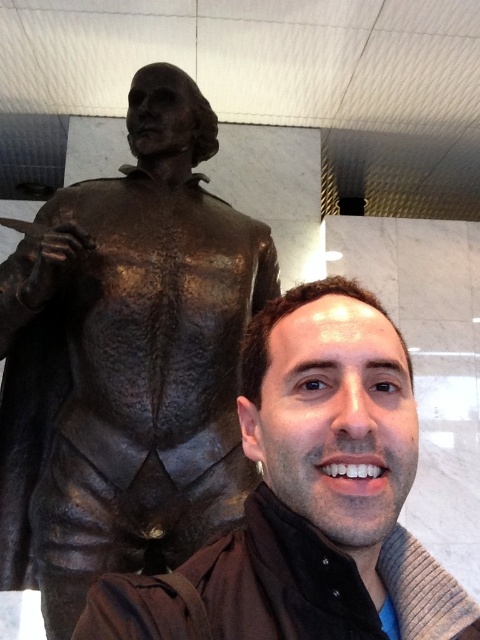
Based on the photo, you are standing in the same room as the bronze statue at left. If you want to take a selfie with the statue, where should you position yourself relative to the statue?

You should position yourself in front of the bronze statue at left to take a selfie with it.